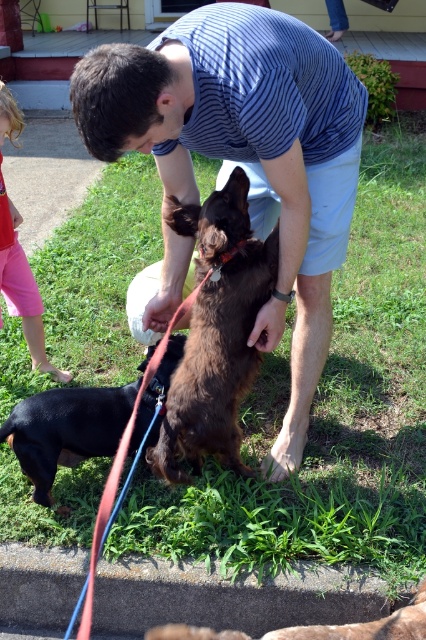
Does pink cotton shorts at lower left have a greater height compared to brown furry dog at lower center?

Correct, pink cotton shorts at lower left is much taller as brown furry dog at lower center.

Is pink cotton shorts at lower left in front of brown furry dog at lower center?

That is False.

The width and height of the screenshot is (426, 640). What do you see at coordinates (22, 285) in the screenshot?
I see `pink cotton shorts at lower left` at bounding box center [22, 285].

Where is `pink cotton shorts at lower left`? pink cotton shorts at lower left is located at coordinates (22, 285).

Which is more to the left, black smooth dog at lower left or brown furry dog at lower center?

black smooth dog at lower left is more to the left.

Who is more distant from viewer, (36, 460) or (293, 628)?

Positioned behind is point (36, 460).

You are a GUI agent. You are given a task and a screenshot of the screen. Output one action in this format:
    pyautogui.click(x=<x>, y=<y>)
    Task: Click on the black smooth dog at lower left
    
    Given the screenshot: What is the action you would take?
    pyautogui.click(x=66, y=429)

Is striped cotton shirt at center smaller than pink cotton shorts at lower left?

No, striped cotton shirt at center is not smaller than pink cotton shorts at lower left.

Identify the location of striped cotton shirt at center. (242, 161).

Where is `striped cotton shirt at center`? striped cotton shirt at center is located at coordinates (242, 161).